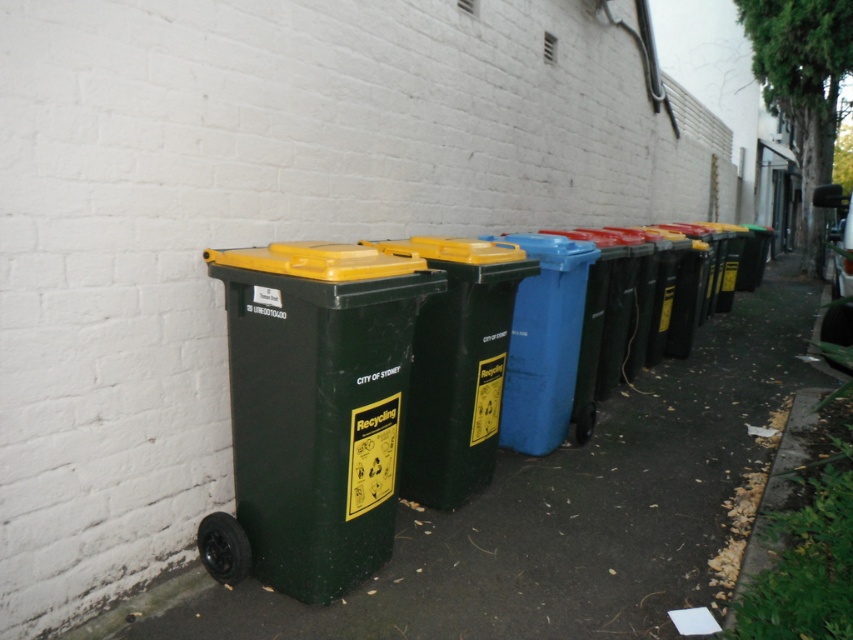
Between matte green recycling bin at left and green plastic recycling bin at center, which one is positioned higher?

Positioned higher is green plastic recycling bin at center.

The width and height of the screenshot is (853, 640). I want to click on matte green recycling bin at left, so click(x=312, y=412).

Can you confirm if green plastic recycling bin at center is positioned above blue plastic bin at center?

No.

How much distance is there between green plastic recycling bin at center and blue plastic bin at center?

green plastic recycling bin at center is 64.42 centimeters from blue plastic bin at center.

In order to click on green plastic recycling bin at center in this screenshot , I will do `click(457, 365)`.

Measure the distance between point [387,307] and camera.

The distance of point [387,307] from camera is 8.24 feet.

Does matte green recycling bin at left come in front of blue plastic bin at center?

Yes, matte green recycling bin at left is in front of blue plastic bin at center.

Which is in front, point (234, 566) or point (569, 244)?

Positioned in front is point (234, 566).

Locate an element on the screen. matte green recycling bin at left is located at coordinates (312, 412).